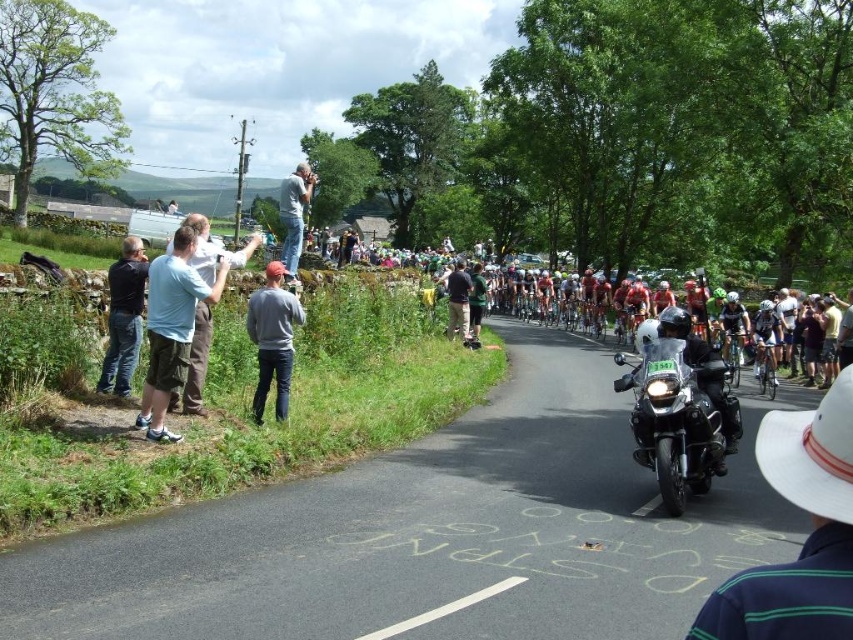
Question: Among these objects, which one is farthest from the camera?

Choices:
 (A) gray sweater at center
 (B) dark blue jeans at left
 (C) shiny black motorcycle at center
 (D) shiny silver bicycle at center

Answer: (D)

Question: Is gray sweater at center smaller than light blue shirt at upper center?

Choices:
 (A) no
 (B) yes

Answer: (B)

Question: Which point is closer to the camera taking this photo?

Choices:
 (A) (155, 384)
 (B) (252, 403)
 (C) (724, 392)
 (D) (769, 358)

Answer: (C)

Question: Is light blue shirt at upper center to the right of shiny silver bicycle at center from the viewer's perspective?

Choices:
 (A) yes
 (B) no

Answer: (B)

Question: Among these points, which one is farthest from the camera?

Choices:
 (A) (757, 368)
 (B) (173, 320)
 (C) (265, 294)

Answer: (A)

Question: Does gray sweater at center have a smaller size compared to light blue shirt at upper center?

Choices:
 (A) yes
 (B) no

Answer: (A)